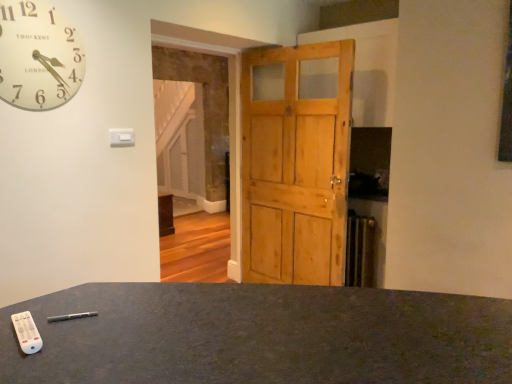
Locate an element on the screen. Image resolution: width=512 pixels, height=384 pixels. vacant point above matte black desk at lower center (from a real-world perspective) is located at coordinates (274, 325).